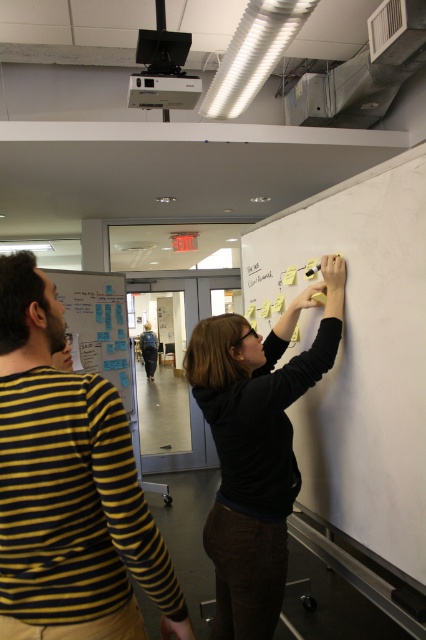
Question: Which object appears farthest from the camera in this image?

Choices:
 (A) yellow striped shirt at left
 (B) white matte whiteboard at upper right
 (C) white paperboard at left

Answer: (C)

Question: Considering the relative positions of white matte whiteboard at upper right and black matte shirt at upper right in the image provided, where is white matte whiteboard at upper right located with respect to black matte shirt at upper right?

Choices:
 (A) above
 (B) below

Answer: (A)

Question: Is white matte whiteboard at upper right below black matte shirt at upper right?

Choices:
 (A) yes
 (B) no

Answer: (B)

Question: Can you confirm if black matte shirt at upper right is smaller than white paperboard at left?

Choices:
 (A) no
 (B) yes

Answer: (B)

Question: Considering the real-world distances, which object is farthest from the black matte shirt at upper right?

Choices:
 (A) white matte whiteboard at upper right
 (B) white paperboard at left

Answer: (B)

Question: Among these points, which one is nearest to the camera?

Choices:
 (A) (412, 164)
 (B) (250, 337)

Answer: (A)